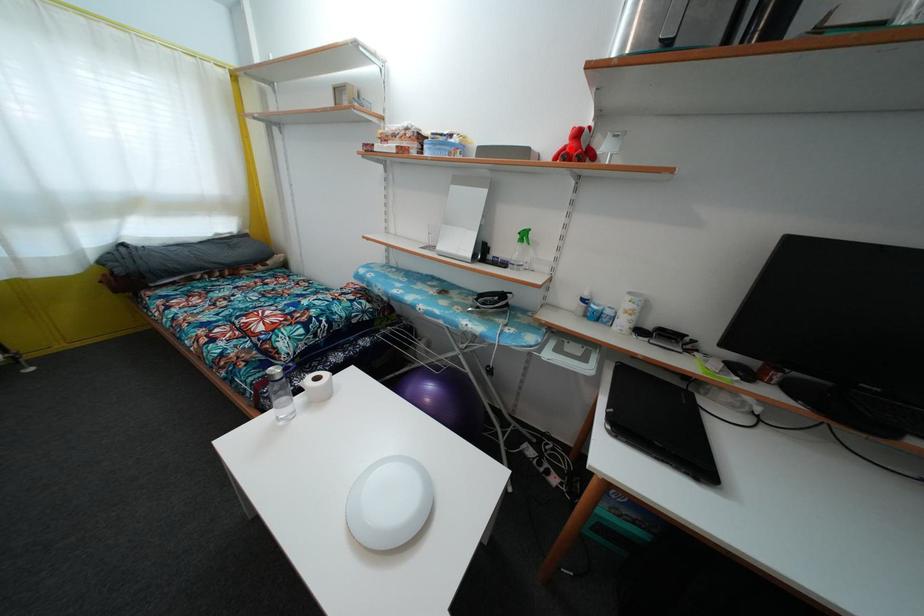
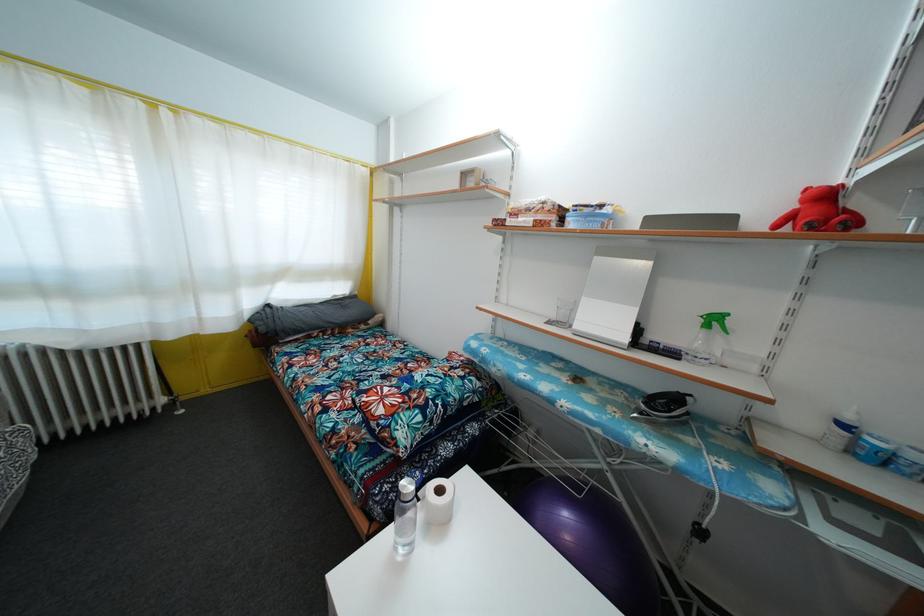
Find the pixel in the second image that matches the highlighted location in the first image.

(800, 213)